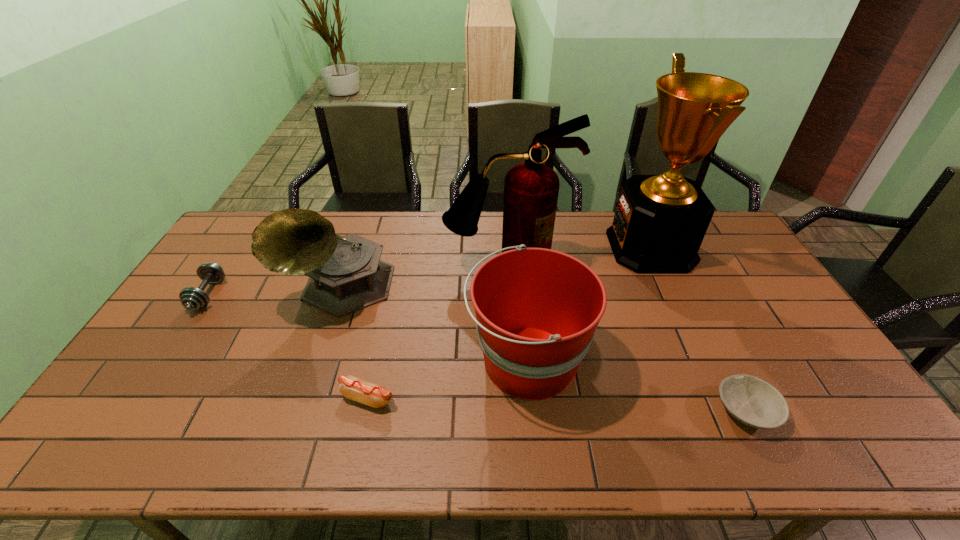
The width and height of the screenshot is (960, 540). In the image, there is a desktop. Identify the location of vacant region at the far edge. (470, 241).

The width and height of the screenshot is (960, 540). In the image, there is a desktop. What are the coordinates of `free region at the near edge` in the screenshot? It's located at (474, 452).

What are the coordinates of `free space at the right edge of the desktop` in the screenshot? It's located at (829, 423).

Identify the location of free space at the far left corner of the desktop. (268, 214).

At what (x,y) coordinates should I click in order to perform the action: click on empty space between the fire extinguisher and the bowl. Please return your answer as a coordinate pair (x, y). This screenshot has height=540, width=960. Looking at the image, I should click on (627, 339).

Find the location of a particular element. The image size is (960, 540). unoccupied position between the phonograph record and the fire extinguisher is located at coordinates (424, 277).

At what (x,y) coordinates should I click in order to perform the action: click on free space between the sixth tallest object and the fire extinguisher. Please return your answer as a coordinate pair (x, y). Looking at the image, I should click on (438, 333).

This screenshot has width=960, height=540. In order to click on blank region between the phonograph record and the dumbbell in this screenshot , I will do `click(275, 291)`.

Find the location of `vacant area that lies between the trophy cup and the shortest object`. vacant area that lies between the trophy cup and the shortest object is located at coordinates (699, 328).

This screenshot has height=540, width=960. I want to click on free space between the bucket and the phonograph record, so click(434, 325).